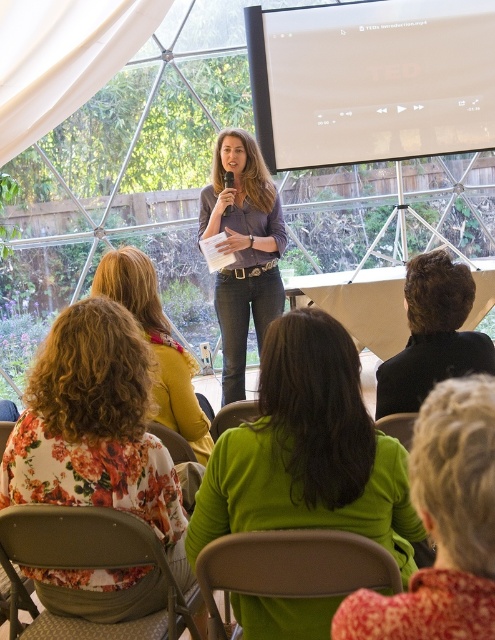
Question: Observing the image, what is the correct spatial positioning of green fabric at center in reference to matte purple shirt at center?

Choices:
 (A) below
 (B) above

Answer: (A)

Question: Is white matte projection screen at upper center behind green matte sweater at center?

Choices:
 (A) yes
 (B) no

Answer: (A)

Question: Which point appears closest to the camera in this image?

Choices:
 (A) (48, 372)
 (B) (266, 102)
 (C) (406, 397)
 (D) (108, 285)

Answer: (A)

Question: Is green matte sweater at center below matte purple shirt at center?

Choices:
 (A) yes
 (B) no

Answer: (A)

Question: Which object is the farthest from the green matte sweater at center?

Choices:
 (A) matte purple shirt at center
 (B) white matte projection screen at upper center
 (C) green fabric at center

Answer: (B)

Question: Based on their relative distances, which object is nearer to the matte purple shirt at center?

Choices:
 (A) floral print blouse at lower left
 (B) white matte projection screen at upper center
 (C) black fabric coat at right

Answer: (B)